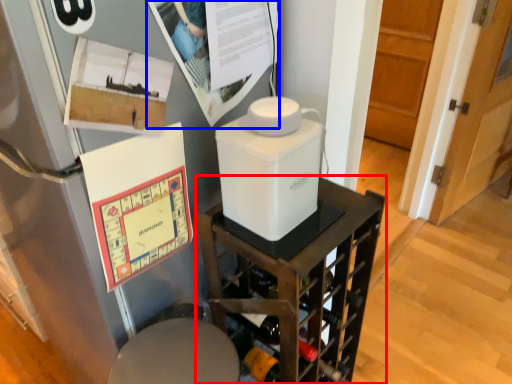
Question: Which object is closer to the camera taking this photo, furniture (highlighted by a red box) or poster page (highlighted by a blue box)?

Choices:
 (A) furniture
 (B) poster page

Answer: (B)